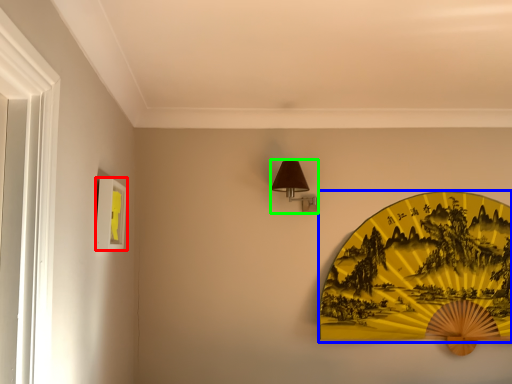
Question: Estimate the real-world distances between objects in this image. Which object is closer to picture frame (highlighted by a red box), design (highlighted by a blue box) or table lamp (highlighted by a green box)?

Choices:
 (A) design
 (B) table lamp

Answer: (B)